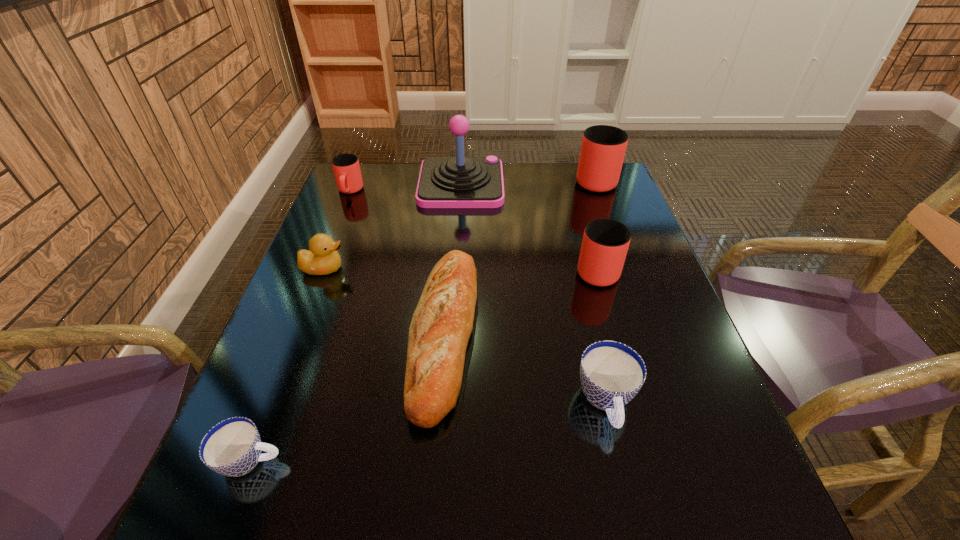
Locate an element on the screen. Image resolution: width=960 pixels, height=540 pixels. empty location between the smallest pink cup and the shortest object is located at coordinates (300, 326).

The height and width of the screenshot is (540, 960). I want to click on free spot between the bigger blue cup and the pink joystick, so click(534, 293).

Image resolution: width=960 pixels, height=540 pixels. I want to click on free space between the baguet and the smallest pink cup, so coord(397,262).

At what (x,y) coordinates should I click in order to perform the action: click on free space that is in between the bigger blue cup and the third nearest cup. Please return your answer as a coordinate pair (x, y). This screenshot has width=960, height=540. Looking at the image, I should click on (601, 335).

The image size is (960, 540). In order to click on empty location between the smallest pink cup and the duckling in this screenshot , I will do `click(337, 230)`.

What are the coordinates of `blank region between the duckling and the smallest pink cup` in the screenshot? It's located at (337, 230).

What are the coordinates of `free area in between the left blue cup and the tallest object` in the screenshot? It's located at (356, 322).

This screenshot has width=960, height=540. What are the coordinates of `free area in between the duckling and the pink joystick` in the screenshot? It's located at (393, 226).

Locate an element on the screen. The image size is (960, 540). the second closest object to the baguet is located at coordinates (323, 259).

Where is `object identified as the third closest to the baguet`? The image size is (960, 540). object identified as the third closest to the baguet is located at coordinates (611, 373).